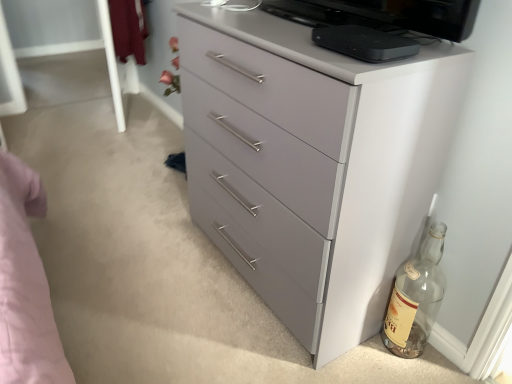
Question: Does black matte device at upper center have a greater width compared to transparent glass bottle at lower right?

Choices:
 (A) no
 (B) yes

Answer: (B)

Question: Is black matte device at upper center in front of transparent glass bottle at lower right?

Choices:
 (A) no
 (B) yes

Answer: (B)

Question: Is black matte device at upper center next to transparent glass bottle at lower right and touching it?

Choices:
 (A) yes
 (B) no

Answer: (B)

Question: Could transparent glass bottle at lower right be considered to be inside black matte device at upper center?

Choices:
 (A) no
 (B) yes

Answer: (A)

Question: From the image's perspective, is black matte device at upper center on top of transparent glass bottle at lower right?

Choices:
 (A) no
 (B) yes

Answer: (B)

Question: Considering the relative sizes of black matte device at upper center and transparent glass bottle at lower right in the image provided, is black matte device at upper center thinner than transparent glass bottle at lower right?

Choices:
 (A) yes
 (B) no

Answer: (B)

Question: Is matte gray chest of drawers at center not inside transparent glass bottle at lower right?

Choices:
 (A) yes
 (B) no

Answer: (A)

Question: Considering the relative sizes of matte gray chest of drawers at center and transparent glass bottle at lower right in the image provided, is matte gray chest of drawers at center bigger than transparent glass bottle at lower right?

Choices:
 (A) yes
 (B) no

Answer: (A)

Question: Can you confirm if matte gray chest of drawers at center is taller than transparent glass bottle at lower right?

Choices:
 (A) yes
 (B) no

Answer: (A)

Question: From the image's perspective, is matte gray chest of drawers at center on top of transparent glass bottle at lower right?

Choices:
 (A) no
 (B) yes

Answer: (B)

Question: Can you confirm if matte gray chest of drawers at center is smaller than transparent glass bottle at lower right?

Choices:
 (A) no
 (B) yes

Answer: (A)

Question: Considering the relative positions of matte gray chest of drawers at center and transparent glass bottle at lower right in the image provided, is matte gray chest of drawers at center in front of transparent glass bottle at lower right?

Choices:
 (A) no
 (B) yes

Answer: (B)

Question: Is the depth of transparent glass bottle at lower right less than that of black matte device at upper center?

Choices:
 (A) yes
 (B) no

Answer: (B)